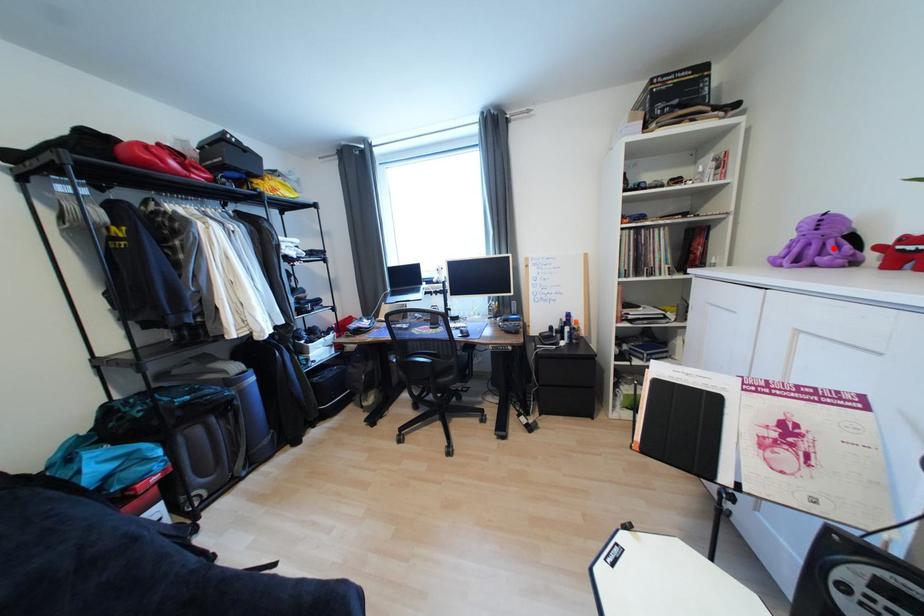
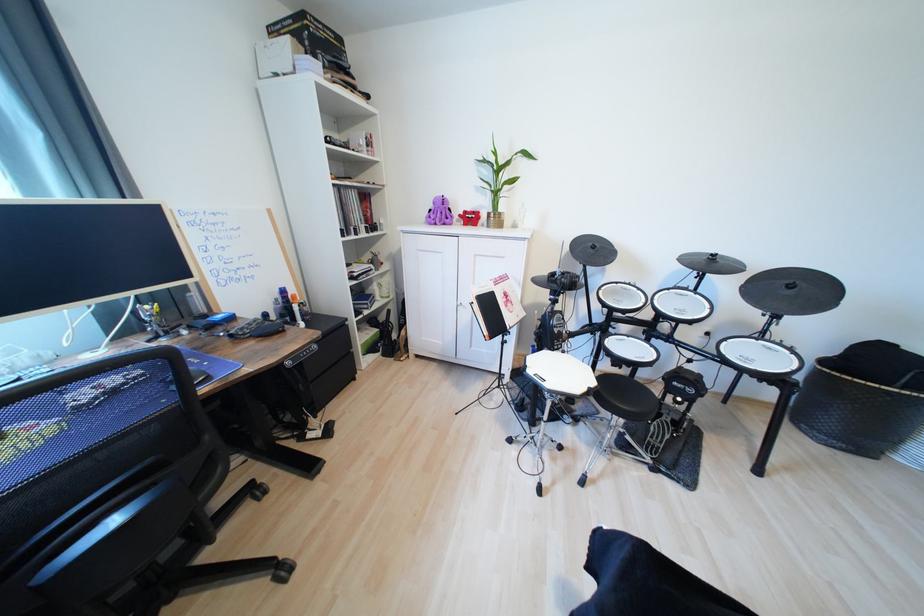
Where in the second image is the point corresponding to the highlighted location from the first image?

(447, 216)